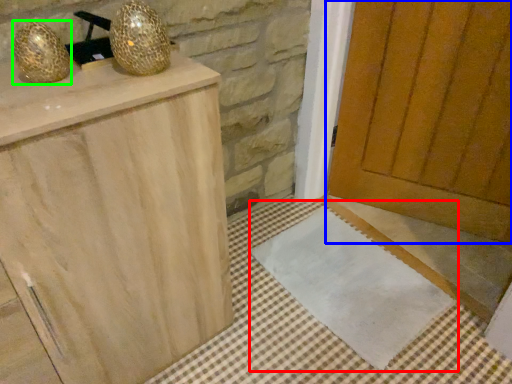
Question: Estimate the real-world distances between objects in this image. Which object is farther from doormat (highlighted by a red box), door (highlighted by a blue box) or disco ball (highlighted by a green box)?

Choices:
 (A) door
 (B) disco ball

Answer: (B)